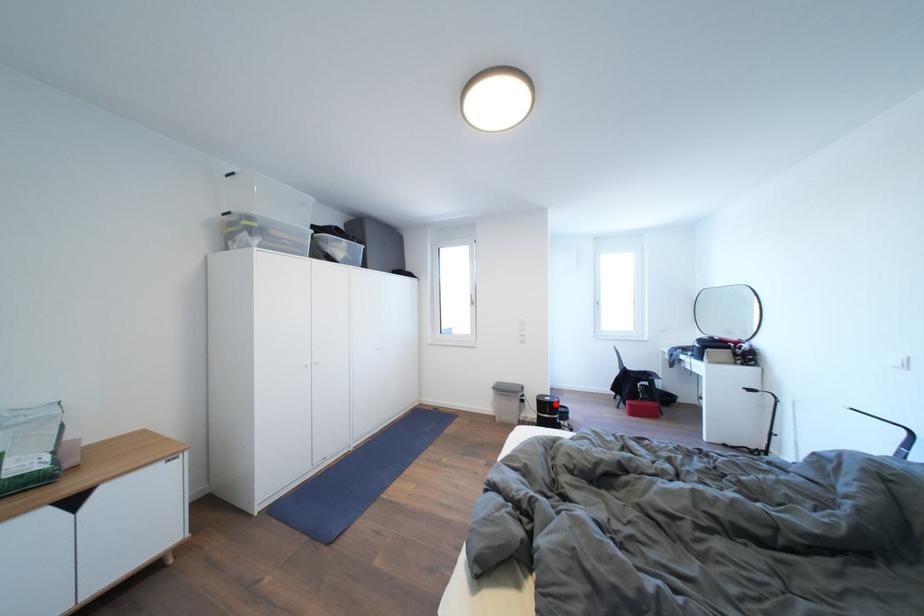
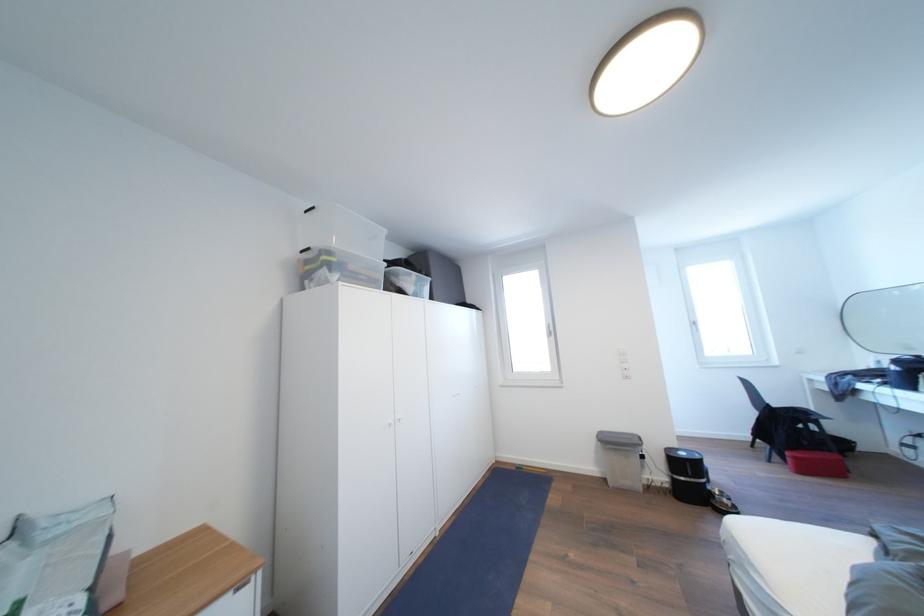
Locate, in the second image, the point that corresponds to the highlighted location in the first image.

(689, 459)